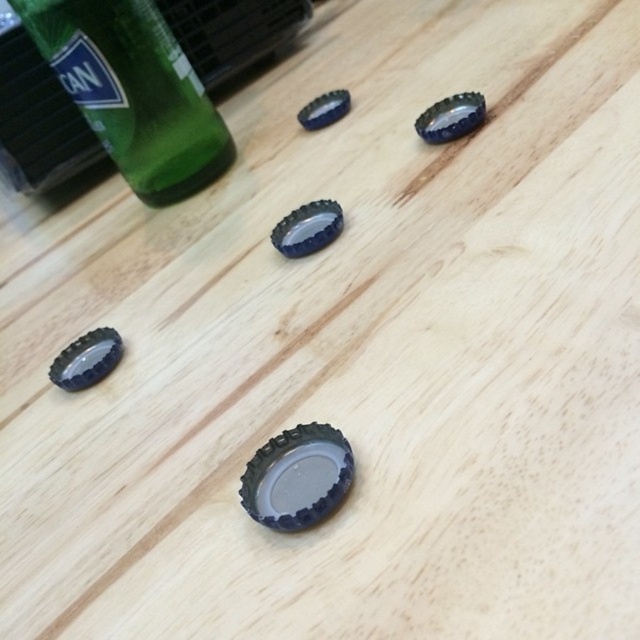
Question: Based on their relative distances, which object is nearer to the black rubber bottle cap at upper center?

Choices:
 (A) black rubber bottle cap at upper right
 (B) black rubber bottle cap at center

Answer: (A)

Question: Estimate the real-world distances between objects in this image. Which object is farther from the black rubber bottle cap at center?

Choices:
 (A) green matte glass bottle at upper left
 (B) black rubber bottle cap at lower left
 (C) black rubber bottle cap at upper center

Answer: (A)

Question: Does black rubber bottle cap at lower left appear on the right side of black rubber bottle cap at center?

Choices:
 (A) no
 (B) yes

Answer: (A)

Question: Considering the real-world distances, which object is closest to the black rubber bottle cap at upper right?

Choices:
 (A) black rubber bottle cap at upper center
 (B) black rubber bottle cap at lower left
 (C) green matte glass bottle at upper left
 (D) black rubber bottle cap at center

Answer: (D)

Question: Does black rubber bottle cap at lower left have a greater width compared to black rubber bottle cap at upper center?

Choices:
 (A) no
 (B) yes

Answer: (B)

Question: Considering the relative positions of green matte glass bottle at upper left and black rubber bottle cap at center in the image provided, where is green matte glass bottle at upper left located with respect to black rubber bottle cap at center?

Choices:
 (A) left
 (B) right

Answer: (A)